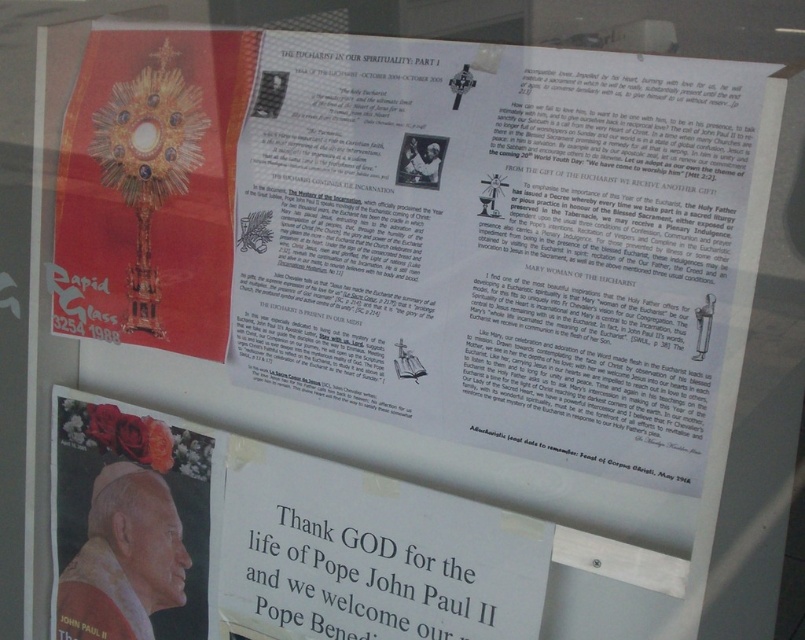
You are an interior designer planning to add a new decorative item between the white paper at center and the white matte portrait of pope john paul ii at lower left. The item you want to place is 5 inches wide. Will there be enough space between them to fit the item without overlapping?

The white paper at center and white matte portrait of pope john paul ii at lower left are 5.48 inches apart from each other. Since the item is 5 inches wide, there is enough space to fit it between them without overlapping.

Based on the scene description, what can be inferred about the spatial relationship between the white paper at center and the white matte portrait of pope john paul ii at lower left?

The white paper at center is shorter than the white matte portrait of pope john paul ii at lower left.